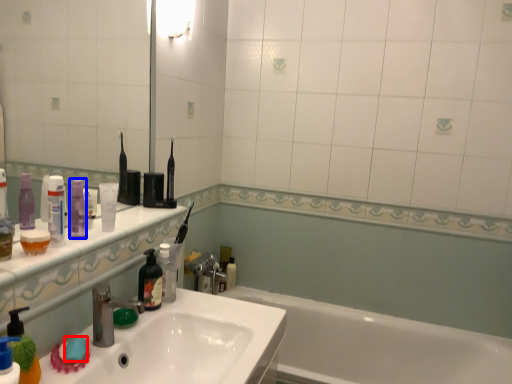
Question: Among these objects, which one is farthest to the camera, soap (highlighted by a red box) or toiletry (highlighted by a blue box)?

Choices:
 (A) soap
 (B) toiletry

Answer: (B)